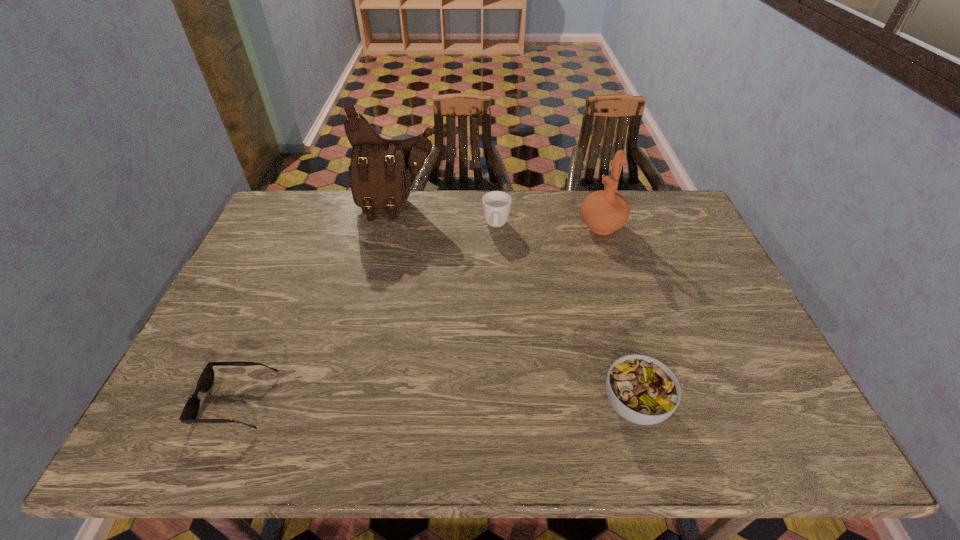
Identify the location of shoulder bag present at the far edge. The image size is (960, 540). (382, 171).

This screenshot has width=960, height=540. Find the location of `sunglasses located at the near edge`. sunglasses located at the near edge is located at coordinates point(191,409).

Identify the location of soup bowl that is at the near edge. This screenshot has width=960, height=540. (643, 390).

At what (x,y) coordinates should I click in order to perform the action: click on object situated at the left edge. Please return your answer as a coordinate pair (x, y). Image resolution: width=960 pixels, height=540 pixels. Looking at the image, I should click on (191, 409).

You are a GUI agent. You are given a task and a screenshot of the screen. Output one action in this format:
    pyautogui.click(x=<x>, y=<y>)
    Task: Click on the object that is at the near left corner
    The width and height of the screenshot is (960, 540).
    Given the screenshot: What is the action you would take?
    pyautogui.click(x=191, y=409)

At what (x,y) coordinates should I click in order to perform the action: click on vacant area at the far edge. Please return your answer as a coordinate pair (x, y). Looking at the image, I should click on (480, 206).

Where is `free spot at the near edge of the desktop`? The width and height of the screenshot is (960, 540). free spot at the near edge of the desktop is located at coordinates (587, 378).

Where is `vacant area at the left edge`? The image size is (960, 540). vacant area at the left edge is located at coordinates (257, 267).

The height and width of the screenshot is (540, 960). I want to click on free space at the right edge, so click(x=729, y=332).

You are a GUI agent. You are given a task and a screenshot of the screen. Output one action in this format:
    pyautogui.click(x=<x>, y=<y>)
    Task: Click on the free space at the near left corner of the desktop
    
    Given the screenshot: What is the action you would take?
    pyautogui.click(x=240, y=393)